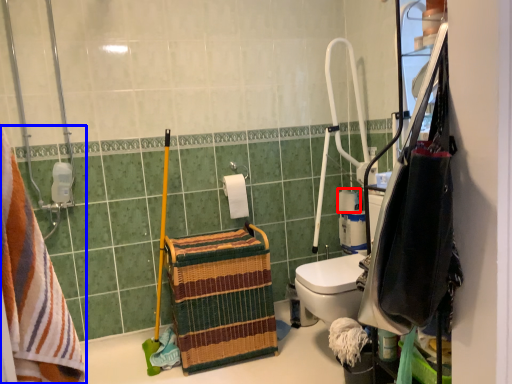
Question: Which object appears farthest to the camera in this image, toilet paper (highlighted by a red box) or towel (highlighted by a blue box)?

Choices:
 (A) toilet paper
 (B) towel

Answer: (A)